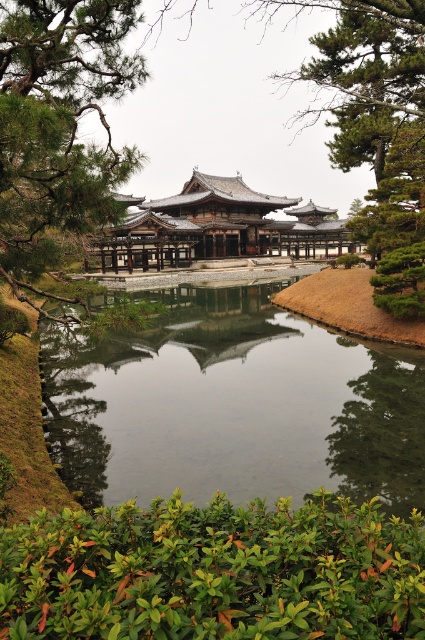
Is clear water at center further to camera compared to green textured pine tree at upper left?

No, it is in front of green textured pine tree at upper left.

Locate an element on the screen. clear water at center is located at coordinates (232, 404).

Image resolution: width=425 pixels, height=640 pixels. Find the location of `clear water at center`. clear water at center is located at coordinates (232, 404).

At what (x,y) coordinates should I click in order to perform the action: click on clear water at center. Please return your answer as a coordinate pair (x, y). Looking at the image, I should click on (232, 404).

Is clear water at center closer to the viewer compared to green leafy bush at lower center?

No, clear water at center is further to the viewer.

Is point (416, 396) less distant than point (232, 604)?

No, it is not.

This screenshot has width=425, height=640. I want to click on clear water at center, so click(x=232, y=404).

Is clear water at center thinner than matte wooden pagoda at center?

Indeed, clear water at center has a lesser width compared to matte wooden pagoda at center.

Is point (96, 392) in front of point (198, 257)?

Yes, it is in front of point (198, 257).

Does point (291, 384) lie behind point (173, 252)?

No.

The image size is (425, 640). I want to click on clear water at center, so click(x=232, y=404).